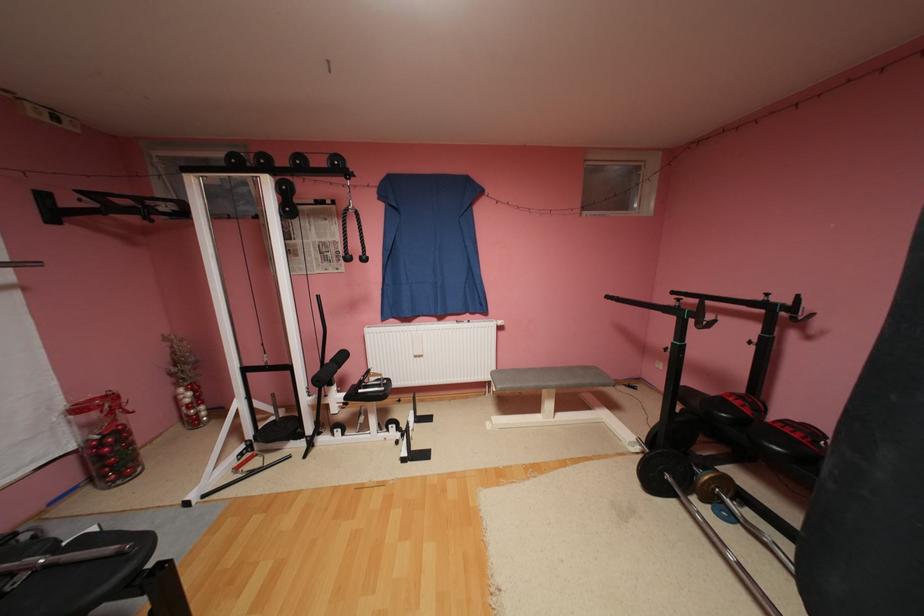
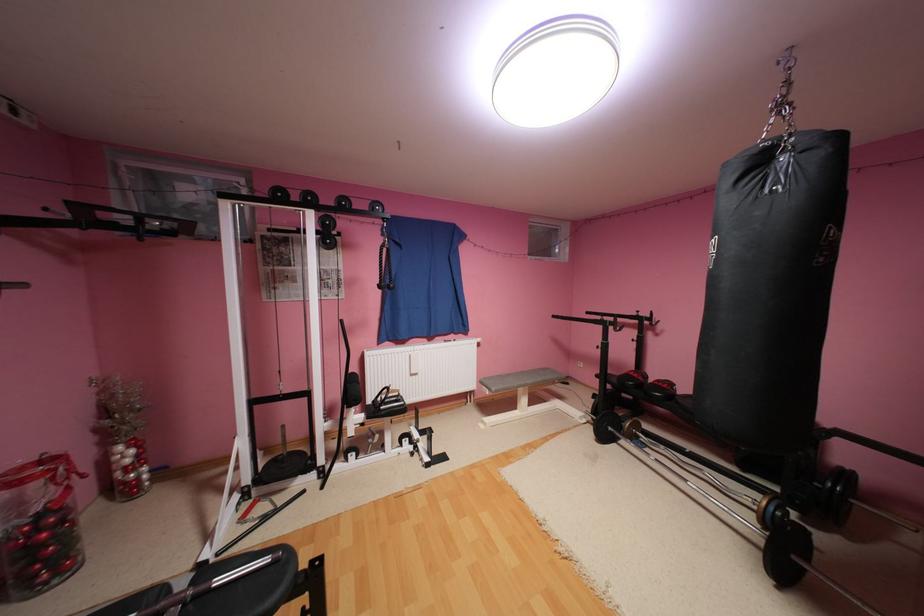
Find the pixel in the second image that matches pixel 120 551 in the first image.

(276, 560)